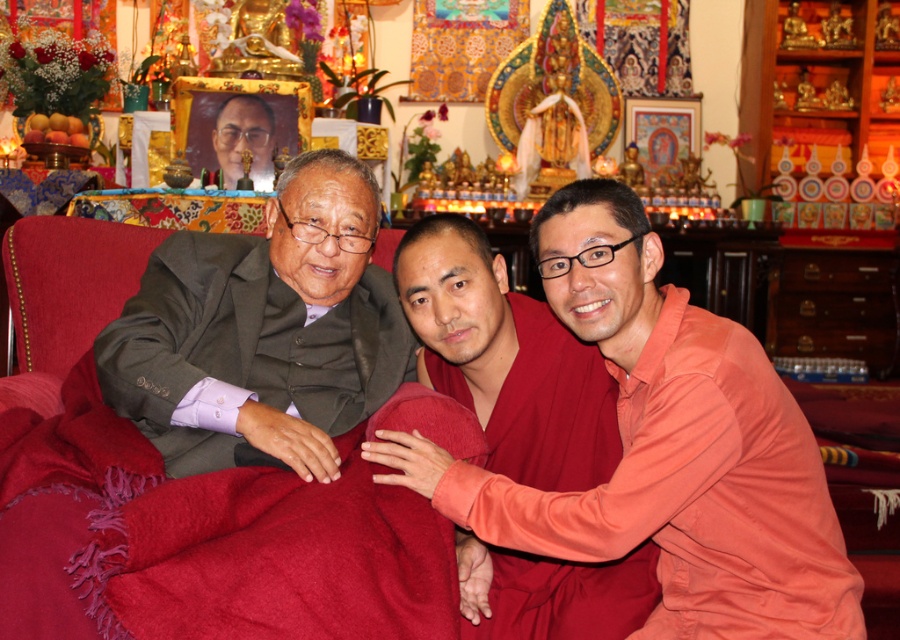
Question: Which point is farther to the camera?

Choices:
 (A) [459, 493]
 (B) [586, 420]
 (C) [162, 356]

Answer: (B)

Question: Is smooth orange shirt at center behind matte black portrait at center?

Choices:
 (A) yes
 (B) no

Answer: (B)

Question: Which point is farther from the camera taking this photo?

Choices:
 (A) (230, 113)
 (B) (648, 445)
 (C) (425, 241)
 (D) (261, 353)

Answer: (A)

Question: Is smooth orange robe at right bigger than gray suit at left?

Choices:
 (A) no
 (B) yes

Answer: (B)

Question: Which object is farther from the camera taking this photo?

Choices:
 (A) gray suit at left
 (B) smooth orange robe at right
 (C) smooth orange shirt at center
 (D) matte black portrait at center

Answer: (D)

Question: Does smooth orange robe at right have a larger size compared to gray suit at left?

Choices:
 (A) yes
 (B) no

Answer: (A)